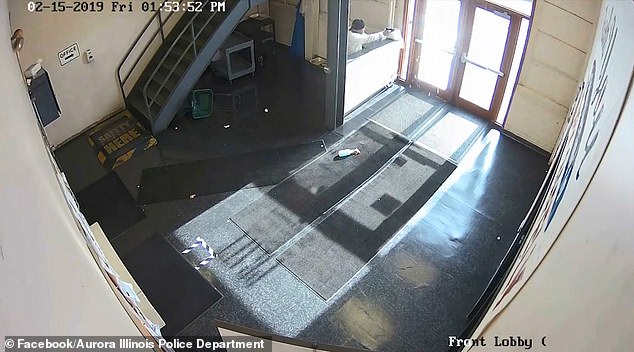
Find the location of a particular element. The image size is (634, 352). door is located at coordinates (440, 76).